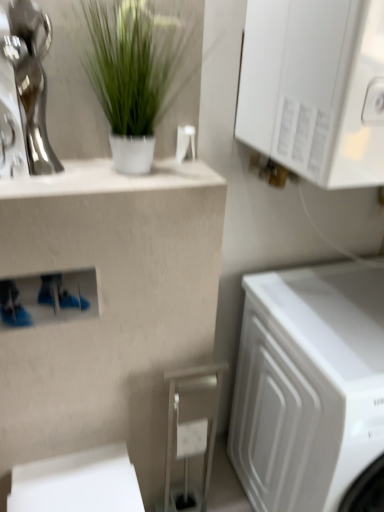
Question: Is matte beige stool at lower center inside the boundaries of shiny silver statue at upper left, or outside?

Choices:
 (A) outside
 (B) inside

Answer: (A)

Question: Is point (201, 452) closer or farther from the camera than point (18, 153)?

Choices:
 (A) closer
 (B) farther

Answer: (B)

Question: Estimate the real-world distances between objects in this image. Which object is farther from the white glossy cabinet at upper right?

Choices:
 (A) matte beige stool at lower center
 (B) white glossy counter top at upper left
 (C) white matte washing machine at lower right
 (D) green matte plant at upper center
 (E) shiny silver statue at upper left

Answer: (A)

Question: Which is nearer to the green matte plant at upper center?

Choices:
 (A) white matte washing machine at lower right
 (B) white glossy cabinet at upper right
 (C) shiny silver statue at upper left
 (D) white glossy counter top at upper left
 (E) matte beige stool at lower center

Answer: (D)